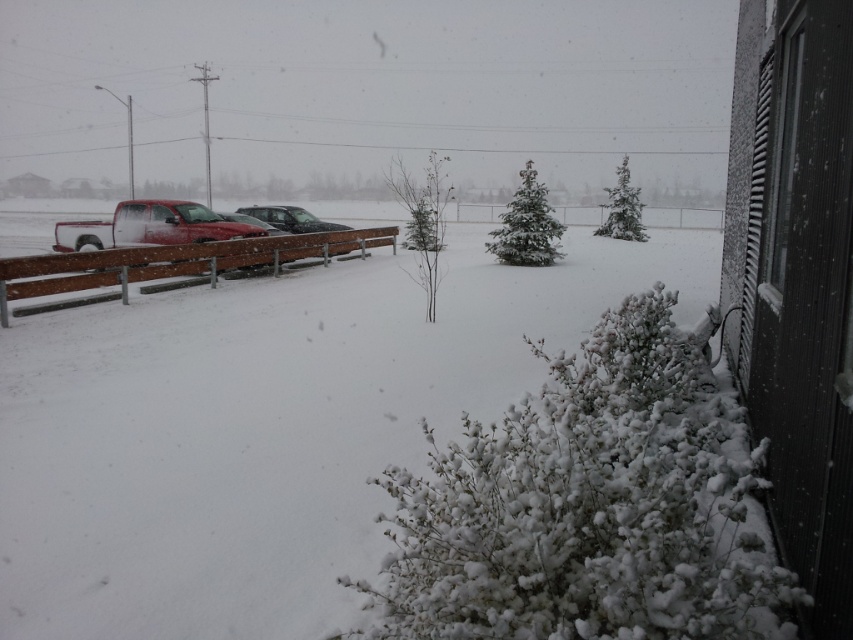
You are trying to park your car in the parking lot shown in the image. You have a car that is 1.8 meters wide. Can you fit your car between the matte red truck at left and the sleek silver sedan at center?

The matte red truck at left might be wider than sleek silver sedan at center, so the space between them is uncertain. It is possible that the space is narrower than your car, so you should check the actual width before attempting to park.

From the picture: You are a delivery person needing to park your 12 foot long van between the matte red truck at left and the sleek silver sedan at center. Can you safely park your van there without overlapping either vehicle?

The distance between the matte red truck at left and the sleek silver sedan at center is 15.25 feet. Since your van is 12 feet long, there is enough space to park between them without overlapping either vehicle.

You are standing on a balcony looking at the snowy scene. There are two points marked in the image. The first point is at coordinates point [196,236] and the second point is at coordinates point [297,227]. Which point is closer to you?

Point [196,236] is closer to the camera than point [297,227].